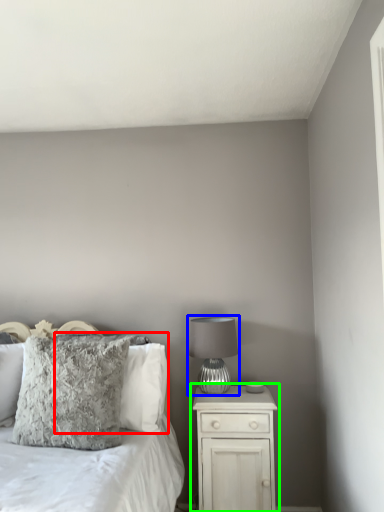
Question: Which object is the farthest from pillow (highlighted by a red box)? Choose among these: table lamp (highlighted by a blue box) or nightstand (highlighted by a green box).

Choices:
 (A) table lamp
 (B) nightstand

Answer: (B)